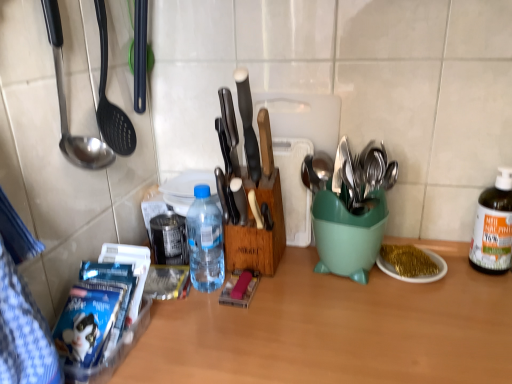
Image resolution: width=512 pixels, height=384 pixels. In order to click on vacant area that lies in front of green plastic spoon holder at right in this screenshot , I will do `click(368, 318)`.